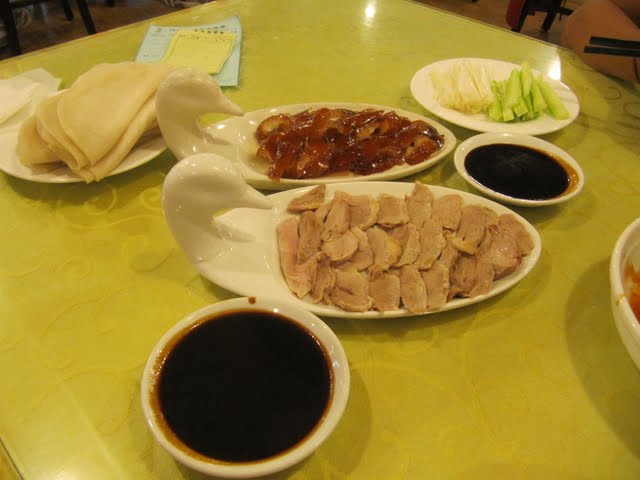
The image size is (640, 480). Find the location of `bright white light reflections on table surface`. bright white light reflections on table surface is located at coordinates (370, 11), (554, 69).